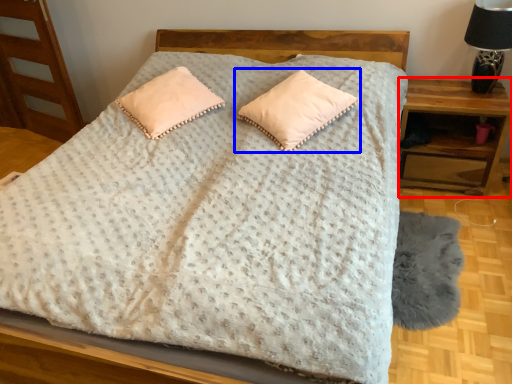
Question: Which of the following is the closest to the observer, nightstand (highlighted by a red box) or pillow (highlighted by a blue box)?

Choices:
 (A) nightstand
 (B) pillow

Answer: (B)